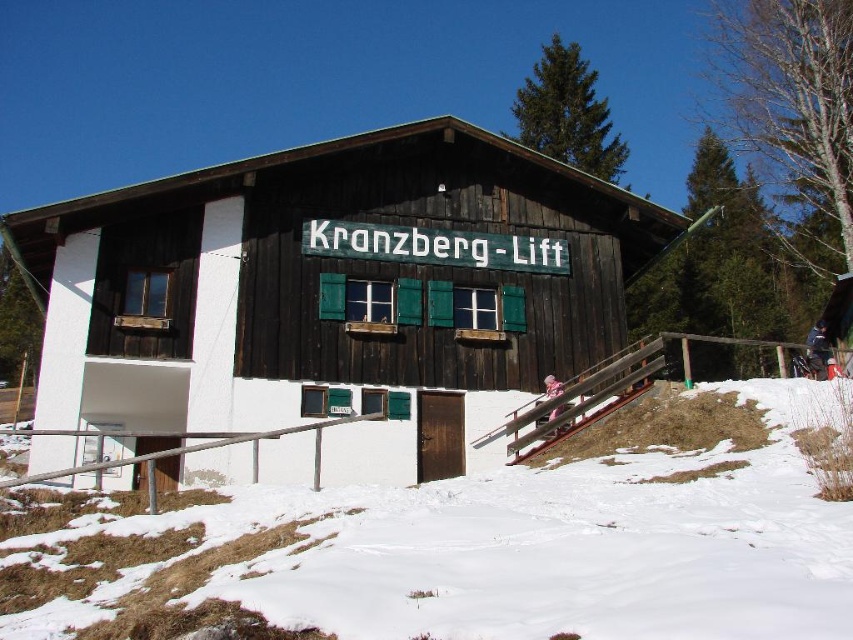
Is point (296, 285) positioned behind point (543, 384)?

That is False.

Which of these two, wooden cabin at center or pink fabric at center, stands taller?

Standing taller between the two is wooden cabin at center.

Find the location of a particular element. wooden cabin at center is located at coordinates (338, 291).

Does white powdery snow at lower center have a greater width compared to pink fabric at center?

Yes, white powdery snow at lower center is wider than pink fabric at center.

Who is positioned more to the left, white powdery snow at lower center or pink fabric at center?

white powdery snow at lower center is more to the left.

Between point (689, 392) and point (550, 396), which one is positioned in front?

Positioned in front is point (689, 392).

Identify the location of white powdery snow at lower center. (465, 548).

Can you confirm if wooden cabin at center is taller than white powdery snow at lower center?

Indeed, wooden cabin at center has a greater height compared to white powdery snow at lower center.

Can you confirm if wooden cabin at center is bigger than white powdery snow at lower center?

Yes, wooden cabin at center is bigger than white powdery snow at lower center.

What are the coordinates of `wooden cabin at center` in the screenshot? It's located at (338, 291).

What are the coordinates of `wooden cabin at center` in the screenshot? It's located at (338, 291).